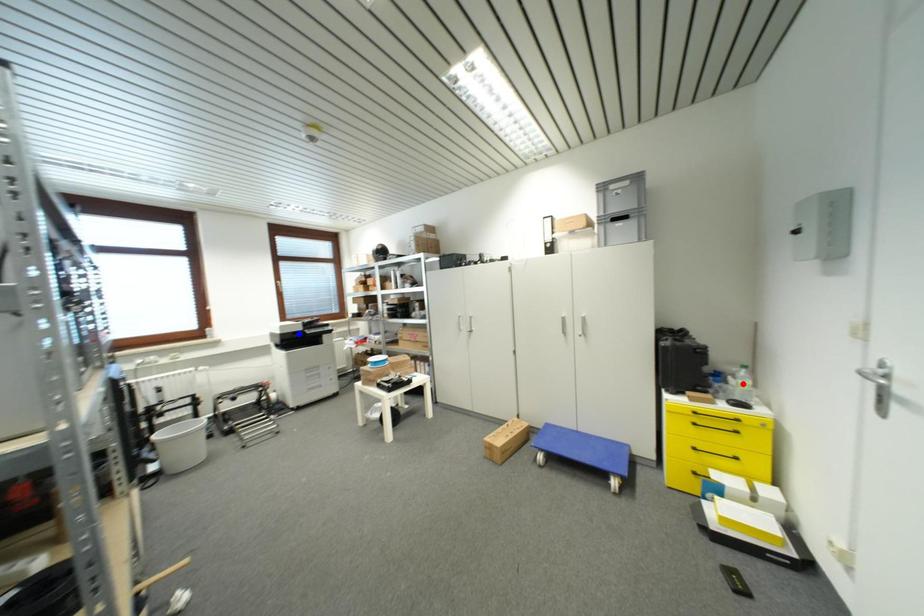
Question: In the image, two points are highlighted. Which point is nearer to the camera? Reply with the corresponding letter.

Choices:
 (A) blue point
 (B) red point

Answer: (B)